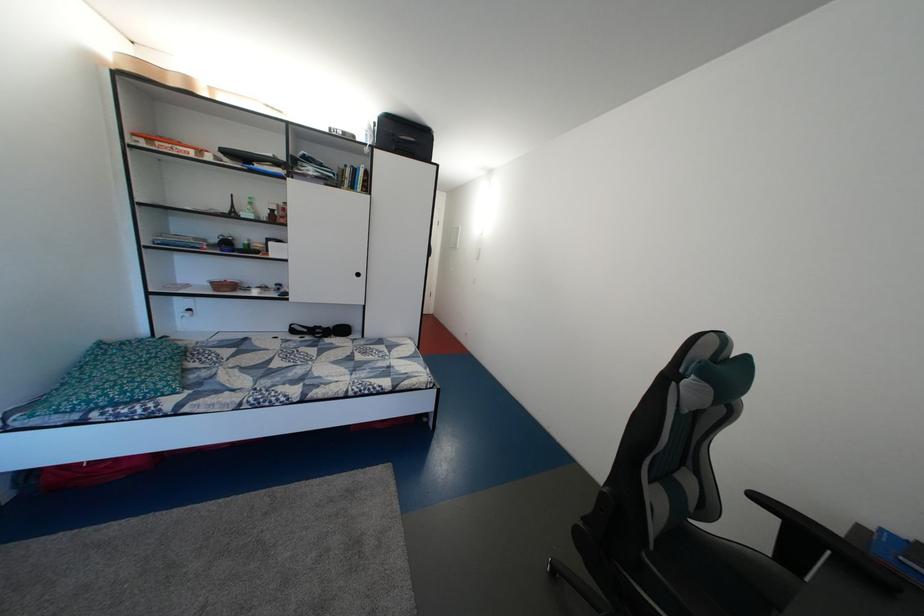
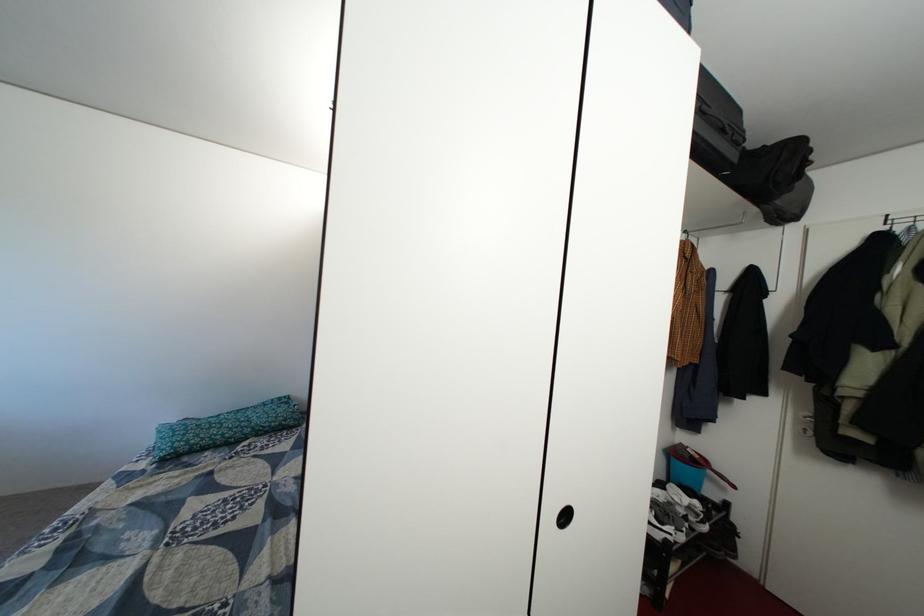
In the second image, find the point that corresponds to point (160, 376) in the first image.

(222, 435)